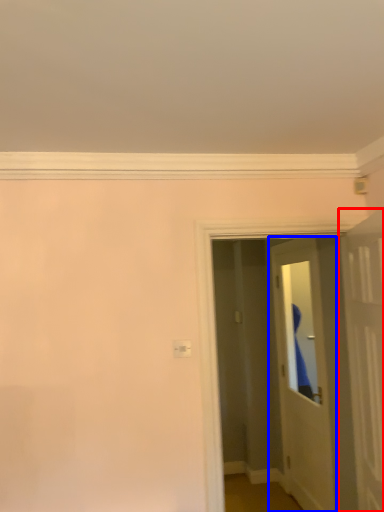
Question: Among these objects, which one is farthest to the camera, door (highlighted by a red box) or door (highlighted by a blue box)?

Choices:
 (A) door
 (B) door

Answer: (B)